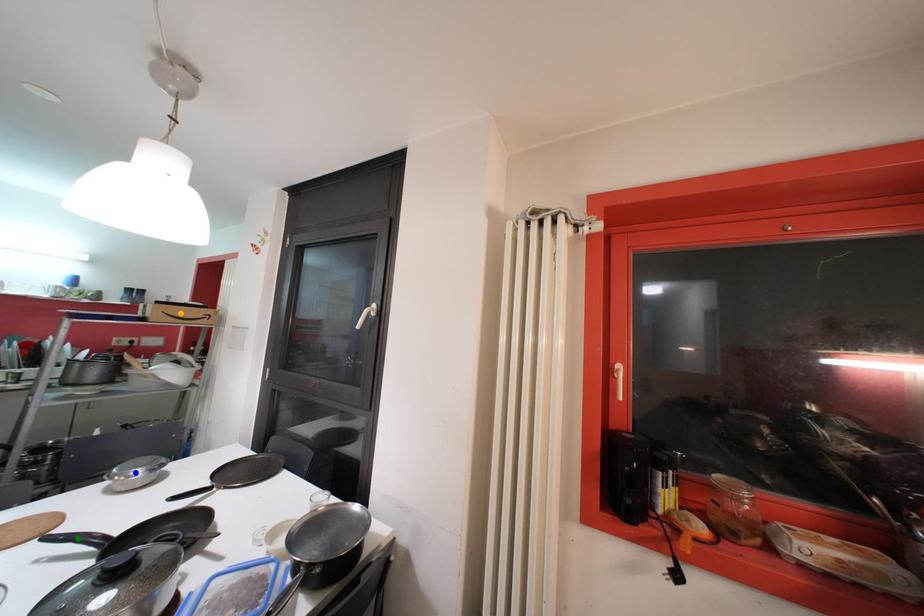
Order these from nearest to farthest:
orange point, green point, blue point

green point
blue point
orange point